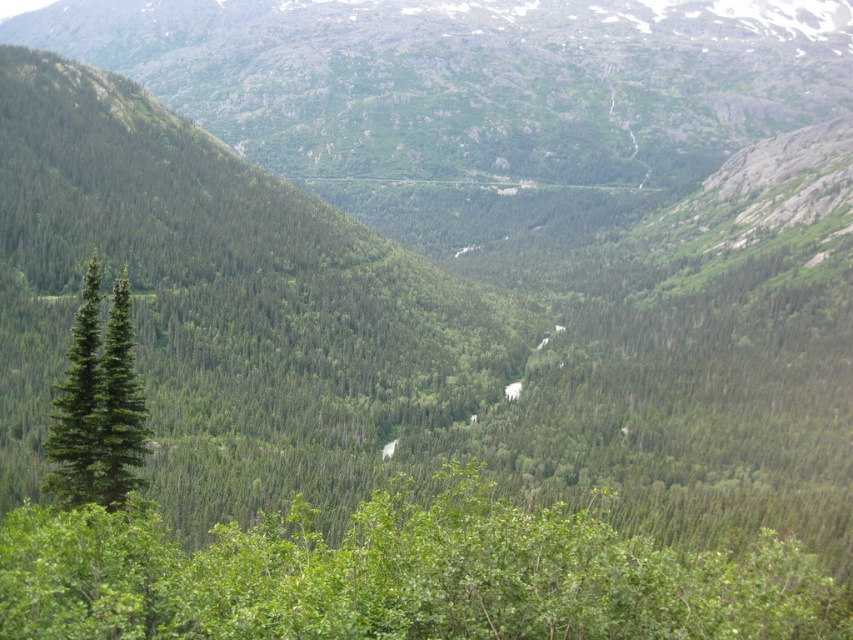
Question: Which point is closer to the camera taking this photo?

Choices:
 (A) (128, 416)
 (B) (602, 616)

Answer: (B)

Question: Can you confirm if green leafy tree at lower left is smaller than green matte tree at left?

Choices:
 (A) yes
 (B) no

Answer: (B)

Question: Is green leafy tree at lower left wider than green matte tree at left?

Choices:
 (A) no
 (B) yes

Answer: (B)

Question: Is green leafy tree at lower left to the right of green matte tree at left from the viewer's perspective?

Choices:
 (A) yes
 (B) no

Answer: (A)